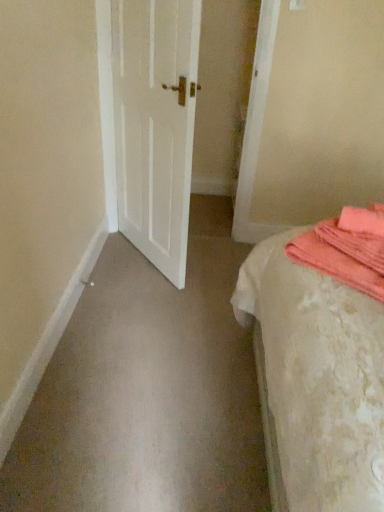
Identify the location of white textured bed at right. This screenshot has width=384, height=512. (323, 357).

Describe the element at coordinates (347, 249) in the screenshot. I see `coral soft towel at right` at that location.

In order to click on white textured bed at right in this screenshot , I will do `click(323, 357)`.

Between point (372, 253) and point (293, 478), which one is positioned in front?

The point (293, 478) is closer.

Considering the positions of objects coral soft towel at right and white textured bed at right in the image provided, who is in front, coral soft towel at right or white textured bed at right?

white textured bed at right is more forward.

Who is shorter, coral soft towel at right or white textured bed at right?

coral soft towel at right.

Could white textured bed at right be considered to be inside coral soft towel at right?

That's incorrect, white textured bed at right is not inside coral soft towel at right.

From a real-world perspective, does white textured bed at right sit lower than white matte door at center?

Yes.

Does white textured bed at right touch white matte door at center?

No, white textured bed at right is not touching white matte door at center.

Is there a large distance between coral soft towel at right and white matte door at center?

Yes, coral soft towel at right and white matte door at center are located far from each other.

Can you confirm if coral soft towel at right is shorter than white matte door at center?

Indeed, coral soft towel at right has a lesser height compared to white matte door at center.

Could you tell me if white matte door at center is facing coral soft towel at right?

No, white matte door at center is not aimed at coral soft towel at right.

Is white matte door at center closer to camera compared to coral soft towel at right?

No, white matte door at center is behind coral soft towel at right.

Which is more to the right, white matte door at center or coral soft towel at right?

Positioned to the right is coral soft towel at right.

Who is smaller, white matte door at center or white textured bed at right?

white matte door at center.

Which of these two, white matte door at center or white textured bed at right, stands shorter?

With less height is white textured bed at right.

From the image's perspective, between white matte door at center and white textured bed at right, which one is located above?

white matte door at center.

In terms of width, does white matte door at center look wider or thinner when compared to white textured bed at right?

Considering their sizes, white matte door at center looks slimmer than white textured bed at right.

How many degrees apart are the facing directions of white textured bed at right and coral soft towel at right?

white textured bed at right and coral soft towel at right are facing 52 degrees away from each other.

Is white textured bed at right looking in the opposite direction of coral soft towel at right?

Yes, white textured bed at right is positioned with its back facing coral soft towel at right.

Which of these two, white textured bed at right or coral soft towel at right, stands taller?

white textured bed at right is taller.

In the scene shown: From the image's perspective, is white textured bed at right located above or below coral soft towel at right?

white textured bed at right is situated lower than coral soft towel at right in the image.

Where is `blanket above the white textured bed at right (from a real-world perspective)`? This screenshot has width=384, height=512. blanket above the white textured bed at right (from a real-world perspective) is located at coordinates (347, 249).

Find the location of `bed in front of the white matte door at center`. bed in front of the white matte door at center is located at coordinates (323, 357).

When comparing their distances from white textured bed at right, does coral soft towel at right or white matte door at center seem further?

Answer: white matte door at center.

Which object lies further to the anchor point white matte door at center, coral soft towel at right or white textured bed at right?

Based on the image, coral soft towel at right appears to be further to white matte door at center.

When comparing their distances from coral soft towel at right, does white textured bed at right or white matte door at center seem closer?

white textured bed at right is closer to coral soft towel at right.

Which object lies nearer to the anchor point white matte door at center, white textured bed at right or coral soft towel at right?

Among the two, white textured bed at right is located nearer to white matte door at center.

From the image, which object appears to be farther from coral soft towel at right, white matte door at center or white textured bed at right?

Among the two, white matte door at center is located further to coral soft towel at right.

When comparing their distances from white textured bed at right, does white matte door at center or coral soft towel at right seem closer?

The object closer to white textured bed at right is coral soft towel at right.

This screenshot has width=384, height=512. Find the location of `blanket between white textured bed at right and white matte door at center from front to back`. blanket between white textured bed at right and white matte door at center from front to back is located at coordinates (347, 249).